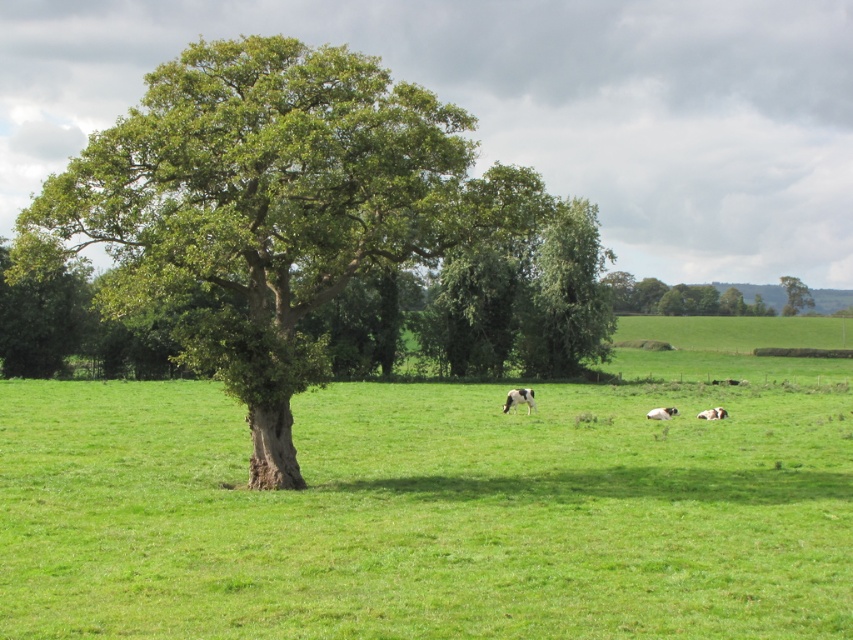
Question: Does green grass pasture at center appear over green leafy tree at upper right?

Choices:
 (A) no
 (B) yes

Answer: (A)

Question: Does green leafy tree at center have a greater width compared to white-spotted fur at center?

Choices:
 (A) no
 (B) yes

Answer: (B)

Question: Which point is farther to the camera?

Choices:
 (A) (502, 408)
 (B) (799, 282)

Answer: (B)

Question: Which of the following is the farthest from the observer?

Choices:
 (A) (71, 388)
 (B) (669, 416)
 (C) (512, 403)
 (D) (782, 285)

Answer: (D)

Question: Does white-spotted fur at center have a greater width compared to white speckled fur at lower right?

Choices:
 (A) yes
 (B) no

Answer: (B)

Question: Which of these objects is positioned farthest from the green leafy oak tree at center?

Choices:
 (A) white speckled fur at lower right
 (B) green grass pasture at center

Answer: (A)